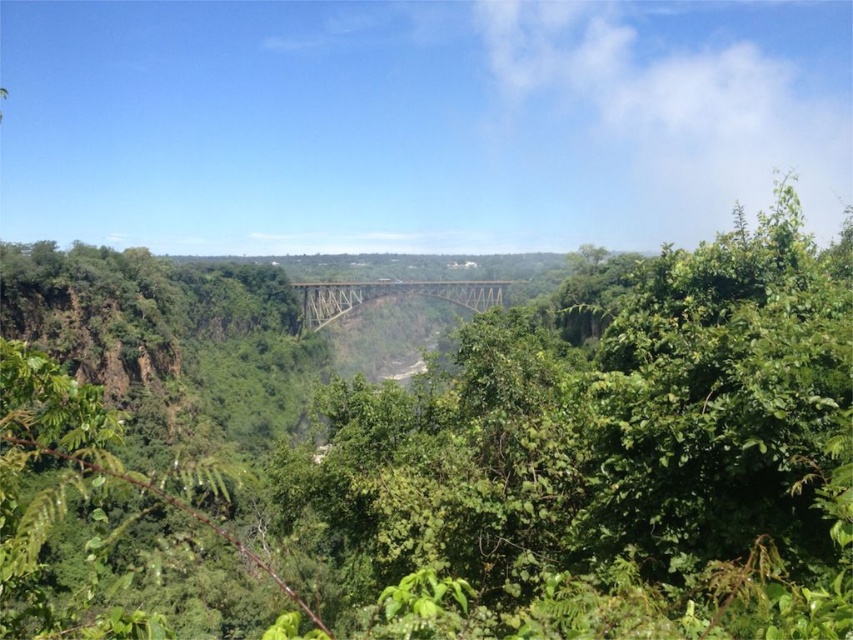
Question: Can you confirm if green leafy tree at center is positioned below metallic bridge at center?

Choices:
 (A) yes
 (B) no

Answer: (A)

Question: Which object appears closest to the camera in this image?

Choices:
 (A) green leafy tree at center
 (B) metallic bridge at center

Answer: (A)

Question: Does green leafy tree at center have a larger size compared to metallic bridge at center?

Choices:
 (A) no
 (B) yes

Answer: (B)

Question: Among these points, which one is nearest to the camera?

Choices:
 (A) [339, 289]
 (B) [544, 316]

Answer: (B)

Question: Where is green leafy tree at center located in relation to metallic bridge at center in the image?

Choices:
 (A) below
 (B) above

Answer: (A)